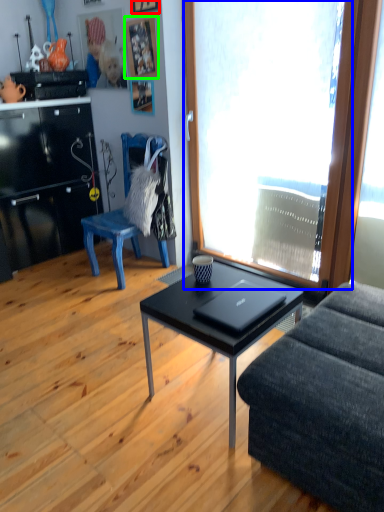
Question: Which is farther away from picture frame (highlighted by a red box)? window (highlighted by a blue box) or picture frame (highlighted by a green box)?

Choices:
 (A) window
 (B) picture frame

Answer: (A)